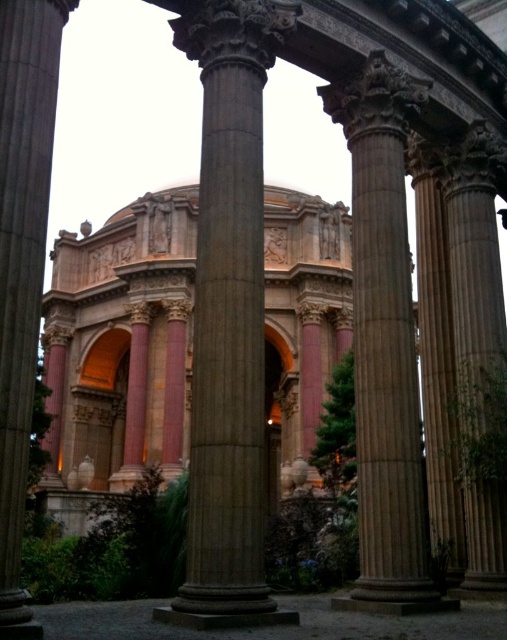
Question: Can you confirm if brown stone column at center is bigger than pink stone column at left?

Choices:
 (A) yes
 (B) no

Answer: (A)

Question: Among these points, which one is nearest to the camera?

Choices:
 (A) (353, 184)
 (B) (260, 262)
 (C) (9, 116)

Answer: (C)

Question: Among these points, which one is farthest from the camera?

Choices:
 (A) (382, 314)
 (B) (229, 230)

Answer: (A)

Question: From the image, what is the correct spatial relationship of brown stone column at center in relation to pink stone column at left?

Choices:
 (A) left
 (B) right

Answer: (B)

Question: Which point is farther from the camera taking this photo?

Choices:
 (A) (10, 22)
 (B) (257, 452)

Answer: (B)

Question: Can you confirm if brown stone column at center is positioned below pink stone column at left?

Choices:
 (A) no
 (B) yes

Answer: (B)